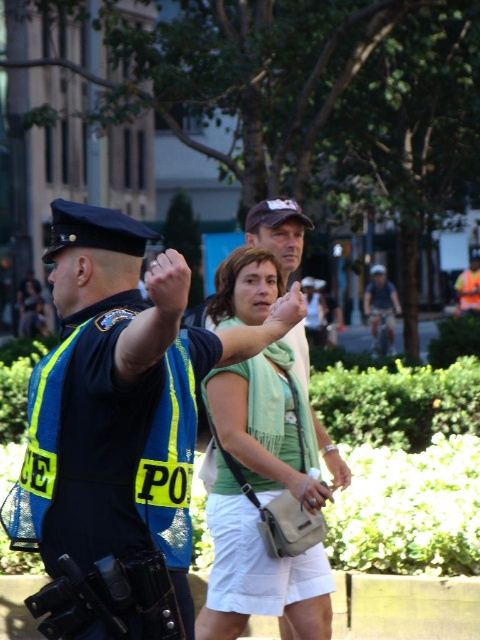
Question: Is matte green shirt at center bigger than green fabric scarf at center?

Choices:
 (A) no
 (B) yes

Answer: (B)

Question: Is the position of matte green shirt at center less distant than that of green fabric scarf at center?

Choices:
 (A) no
 (B) yes

Answer: (B)

Question: Is matte green shirt at center closer to camera compared to green fabric scarf at center?

Choices:
 (A) no
 (B) yes

Answer: (B)